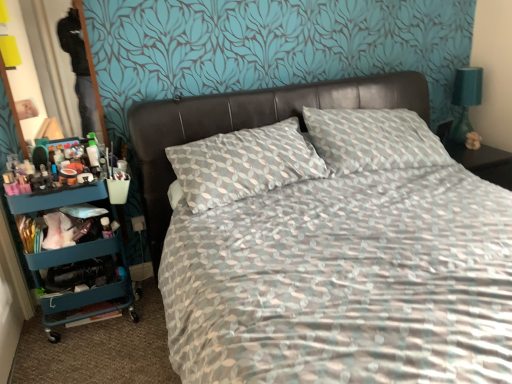
Question: Does leather at center have a greater width compared to teal plastic cart at left?

Choices:
 (A) yes
 (B) no

Answer: (A)

Question: Is leather at center positioned in front of teal plastic cart at left?

Choices:
 (A) yes
 (B) no

Answer: (A)

Question: Does leather at center have a larger size compared to teal plastic cart at left?

Choices:
 (A) no
 (B) yes

Answer: (B)

Question: Can you confirm if leather at center is taller than teal plastic cart at left?

Choices:
 (A) no
 (B) yes

Answer: (A)

Question: Considering the relative sizes of leather at center and teal plastic cart at left in the image provided, is leather at center smaller than teal plastic cart at left?

Choices:
 (A) no
 (B) yes

Answer: (A)

Question: In terms of size, does teal plastic cart at left appear bigger or smaller than leather at center?

Choices:
 (A) big
 (B) small

Answer: (B)

Question: From the image's perspective, relative to leather at center, is teal plastic cart at left above or below?

Choices:
 (A) below
 (B) above

Answer: (A)

Question: Considering the positions of teal plastic cart at left and leather at center in the image, is teal plastic cart at left taller or shorter than leather at center?

Choices:
 (A) short
 (B) tall

Answer: (B)

Question: Is point (58, 256) closer or farther from the camera than point (416, 102)?

Choices:
 (A) closer
 (B) farther

Answer: (A)

Question: In the image, is teal fabric lampshade at right positioned in front of or behind teal plastic cart at left?

Choices:
 (A) front
 (B) behind

Answer: (B)

Question: In terms of width, does teal fabric lampshade at right look wider or thinner when compared to teal plastic cart at left?

Choices:
 (A) thin
 (B) wide

Answer: (A)

Question: Is teal fabric lampshade at right bigger or smaller than teal plastic cart at left?

Choices:
 (A) small
 (B) big

Answer: (A)

Question: From the image's perspective, is teal fabric lampshade at right positioned above or below teal plastic cart at left?

Choices:
 (A) above
 (B) below

Answer: (A)

Question: Looking at the image, does teal plastic cart at left seem bigger or smaller compared to teal fabric lampshade at right?

Choices:
 (A) big
 (B) small

Answer: (A)

Question: Is point (52, 208) closer or farther from the camera than point (452, 130)?

Choices:
 (A) closer
 (B) farther

Answer: (A)